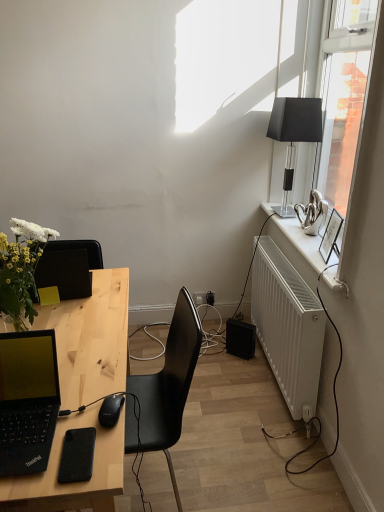
Where is `free space behind black matte mouse at lower left`? The image size is (384, 512). free space behind black matte mouse at lower left is located at coordinates (103, 373).